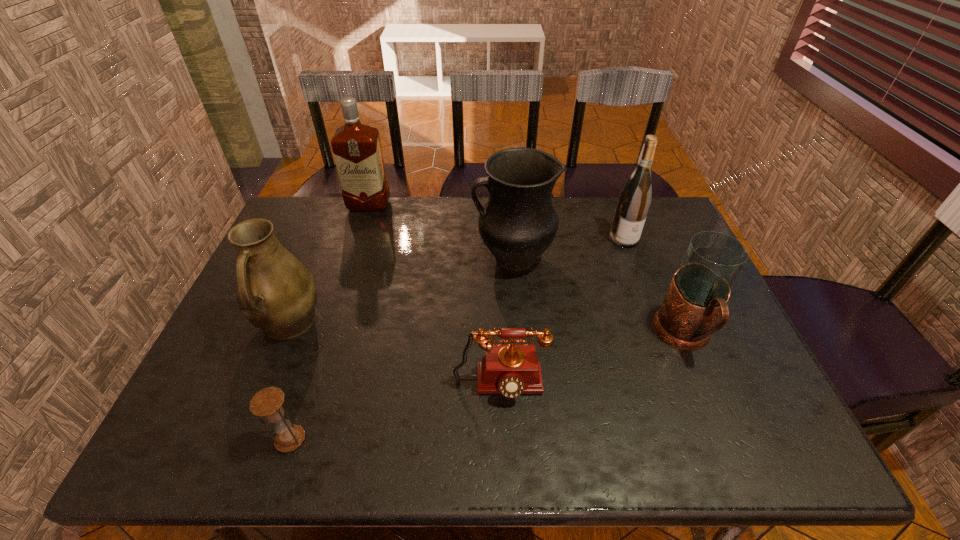
The width and height of the screenshot is (960, 540). Identify the location of the third closest object to the wine bottle. pos(511,370).

You are a GUI agent. You are given a task and a screenshot of the screen. Output one action in this format:
    pyautogui.click(x=<x>, y=<y>)
    Task: Click on the pitcher that stands as the third closest to the hourglass
    
    Given the screenshot: What is the action you would take?
    pyautogui.click(x=699, y=291)

This screenshot has width=960, height=540. What are the coordinates of `the third closest pitcher to the liquor` in the screenshot? It's located at (699, 291).

Identify the location of free space that satisfies the following two spatial constraints: 1. on the front label of the wine bottle; 2. on the left side of the liquor. This screenshot has height=540, width=960. 359,239.

Find the location of a particular element. free space that satisfies the following two spatial constraints: 1. on the handle side of the second pitcher from left to right; 2. on the handle side of the leftmost pitcher is located at coordinates (517, 323).

Image resolution: width=960 pixels, height=540 pixels. I want to click on free location that satisfies the following two spatial constraints: 1. on the handle side of the second pitcher from right to left; 2. on the handle side of the leftmost pitcher, so click(x=517, y=323).